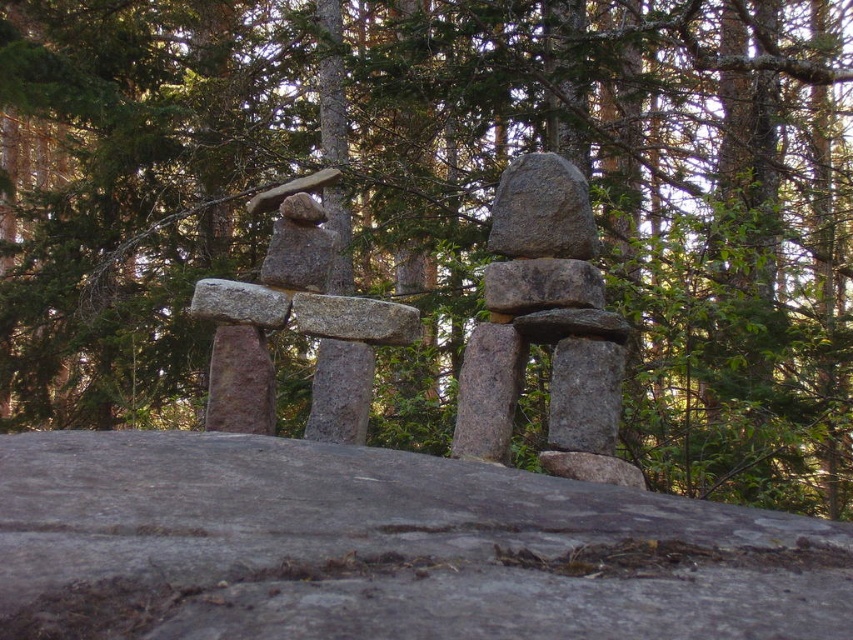
Question: Is smooth gray stone sculpture at center to the left of gray granite rock at center from the viewer's perspective?

Choices:
 (A) no
 (B) yes

Answer: (B)

Question: Estimate the real-world distances between objects in this image. Which object is farther from the gray granite sculpture at center?

Choices:
 (A) gray granite rock at center
 (B) smooth gray stone sculpture at center

Answer: (B)

Question: Considering the real-world distances, which object is closest to the gray rough stone at center?

Choices:
 (A) gray granite rock at center
 (B) smooth gray stone sculpture at center

Answer: (A)

Question: Is gray granite sculpture at center to the left of gray granite rock at center from the viewer's perspective?

Choices:
 (A) no
 (B) yes

Answer: (B)

Question: Estimate the real-world distances between objects in this image. Which object is farther from the gray rough stone at center?

Choices:
 (A) gray granite rock at center
 (B) smooth gray stone sculpture at center
 (C) gray granite sculpture at center

Answer: (B)

Question: In this image, where is gray granite sculpture at center located relative to gray rough stone at center?

Choices:
 (A) right
 (B) left

Answer: (B)